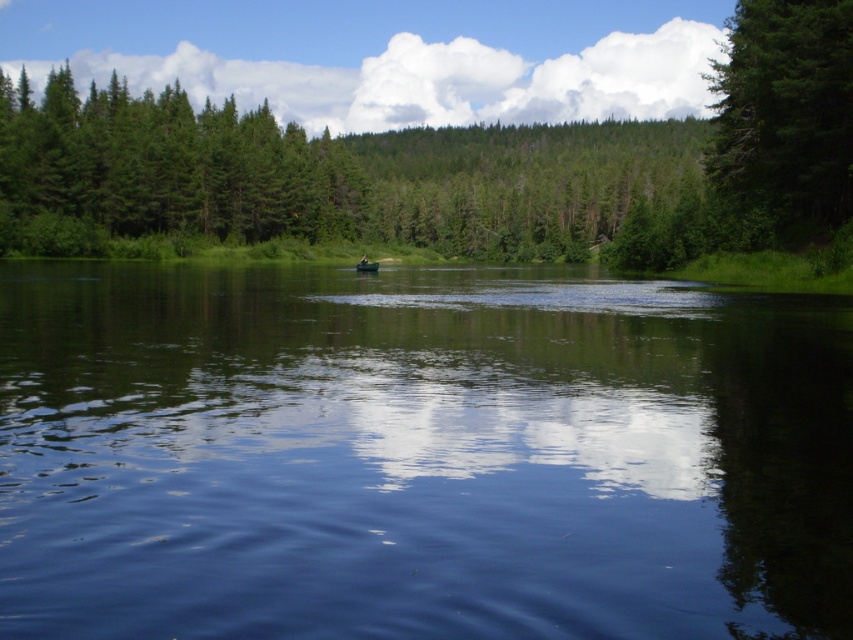
Which of these two, transparent blue water at center or green matte tree at upper right, stands taller?

Standing taller between the two is green matte tree at upper right.

Is transparent blue water at center closer to the viewer compared to green matte tree at upper right?

Yes, it is.

The image size is (853, 640). Find the location of `transparent blue water at center`. transparent blue water at center is located at coordinates (418, 456).

The image size is (853, 640). Find the location of `transparent blue water at center`. transparent blue water at center is located at coordinates (418, 456).